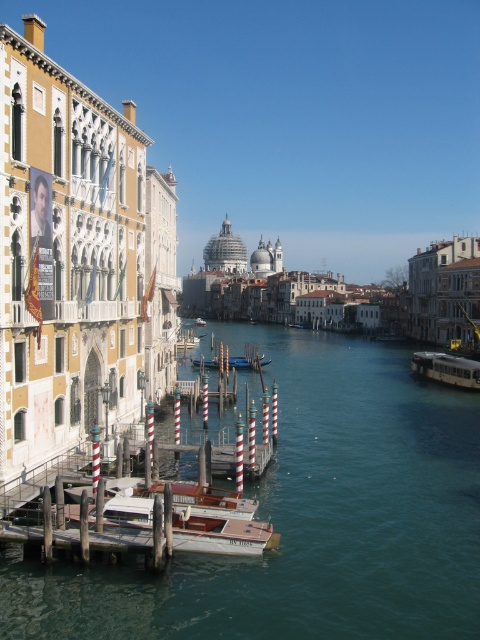
Is point (464, 416) closer to viewer compared to point (144, 513)?

That is False.

Locate an element on the screen. Image resolution: width=480 pixels, height=640 pixels. greenish-blue water at center is located at coordinates (309, 516).

Where is `greenish-blue water at center`? The image size is (480, 640). greenish-blue water at center is located at coordinates (309, 516).

Can you confirm if wooden polished boat at center is positioned to the left of wooden gondola at center?

In fact, wooden polished boat at center is to the right of wooden gondola at center.

Can you confirm if wooden polished boat at center is positioned above wooden gondola at center?

No, wooden polished boat at center is not above wooden gondola at center.

Who is more distant from viewer, [254,512] or [203,321]?

Positioned behind is point [203,321].

This screenshot has height=640, width=480. What are the coordinates of `wooden polished boat at center` in the screenshot? It's located at (212, 500).

Does wooden polished boat at center lie behind wooden dock at center?

No, wooden polished boat at center is in front of wooden dock at center.

Can you confirm if wooden polished boat at center is taller than wooden dock at center?

Incorrect, wooden polished boat at center's height is not larger of wooden dock at center's.

What do you see at coordinates (212, 500) in the screenshot? I see `wooden polished boat at center` at bounding box center [212, 500].

The width and height of the screenshot is (480, 640). Identify the location of wooden polished boat at center. (212, 500).